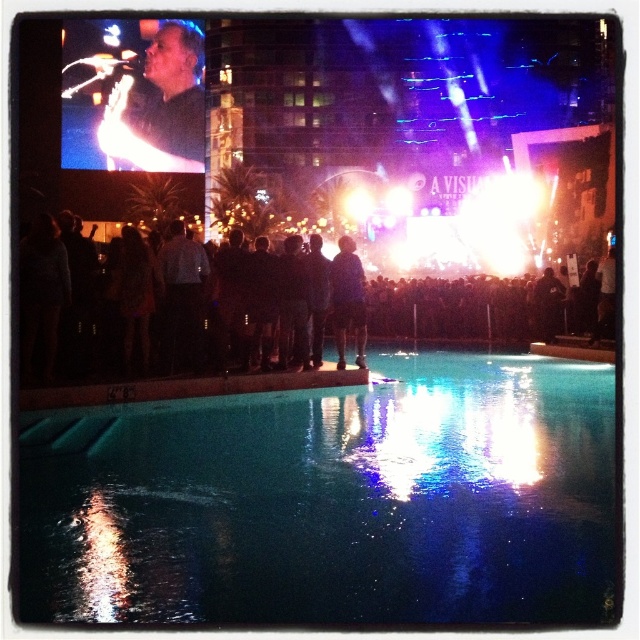
You are standing at the point marked as point [330,500] in the image. What object is directly beneath your feet?

The clear glass pool at lower center is directly beneath your feet at point [330,500].

You are a photographer at the concert and want to capture both the black fabric crowd at center and the dark blue fabric at center in a single shot. Based on their positions, which direction should you move to frame both objects in your camera viewfinder?

Since the black fabric crowd at center is to the right of dark blue fabric at center, you should move to the left to frame both objects in your camera viewfinder so that they are positioned side by side within the viewfinder.

You are a photographer standing at the camera position in the scene. You want to capture a clear shot of the clear glass pool at lower center. Considering the distance, is it advisable to use a telephoto lens to avoid distortion?

The clear glass pool at lower center is 47.05 feet away from the camera. A telephoto lens is suitable for distant subjects as it compresses perspective and reduces distortion, so yes, using a telephoto lens would help capture a clear shot without distortion.